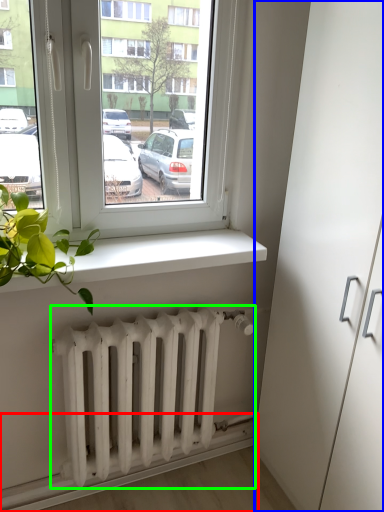
Question: Which object is the closest to the ledge (highlighted by a red box)? Choose among these: glass door (highlighted by a blue box) or radiator (highlighted by a green box).

Choices:
 (A) glass door
 (B) radiator

Answer: (B)